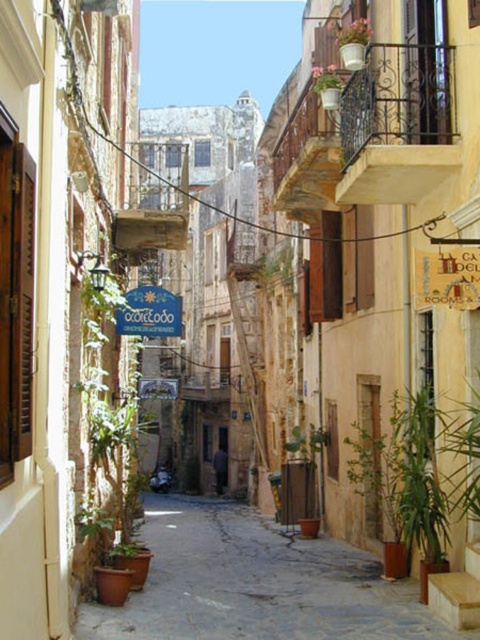
You are a delivery person trying to hang a new sign on a pole in the middle of the street. The pole can only support one sign at a time. Given the wooden signboard at center and the blue painted wood sign at center, which one should you choose to hang without overloading the pole?

The wooden signboard at center is thinner than the blue painted wood sign at center, so you should choose the wooden signboard at center because it is lighter and less likely to overload the pole.

You are a window cleaner needing to reach two flower pots on the same balcony. You have a ladder that can extend up to 1 meter. The green matte pot at upper center and the pink matte flower pot at upper center are both on the upper part of the balcony. Considering their sizes, which pot might be easier to clean with your current ladder?

The green matte pot at upper center occupies less space than the pink matte flower pot at upper center, so it might be easier to clean with the ladder since it requires less reach and maneuvering space.

You are a tourist standing on the cobblestone street looking up at the two signs. Which sign is higher up, the wooden signboard at center or the blue painted wood sign at center?

The wooden signboard at center is positioned over the blue painted wood sign at center, so the wooden signboard at center is higher up.